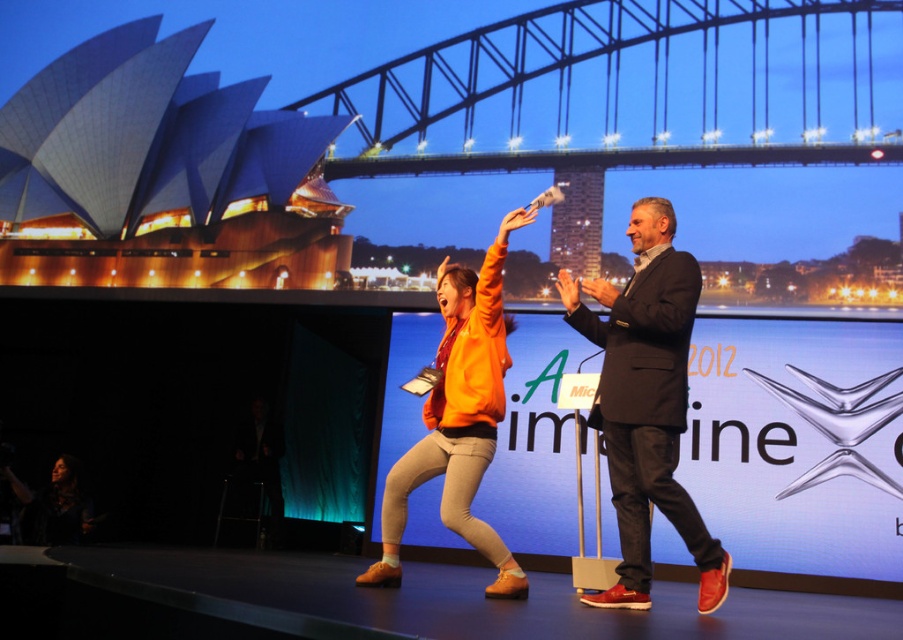
Does dark gray suit at center appear over orange suede shoes at center?

Yes.

Is dark gray suit at center further to camera compared to orange suede shoes at center?

No, it is in front of orange suede shoes at center.

Between point (624, 467) and point (473, 493), which one is positioned in front?

Point (624, 467) is in front.

What are the coordinates of `dark gray suit at center` in the screenshot? It's located at (647, 403).

Which is more to the left, rubber-soled shoes at center or orange suede shoes at center?

rubber-soled shoes at center is more to the left.

Looking at this image, can you confirm if rubber-soled shoes at center is positioned to the left of orange suede shoes at center?

Yes, rubber-soled shoes at center is to the left of orange suede shoes at center.

Find the location of a particular element. Image resolution: width=903 pixels, height=640 pixels. rubber-soled shoes at center is located at coordinates (366, 602).

Locate an element on the screen. rubber-soled shoes at center is located at coordinates (366, 602).

Is orange matte jacket at center positioned in front of dark gray suit at center?

No.

Can you confirm if orange matte jacket at center is positioned below dark gray suit at center?

No, orange matte jacket at center is not below dark gray suit at center.

In order to click on orange matte jacket at center in this screenshot , I will do `click(647, 403)`.

The width and height of the screenshot is (903, 640). What are the coordinates of `orange matte jacket at center` in the screenshot? It's located at (647, 403).